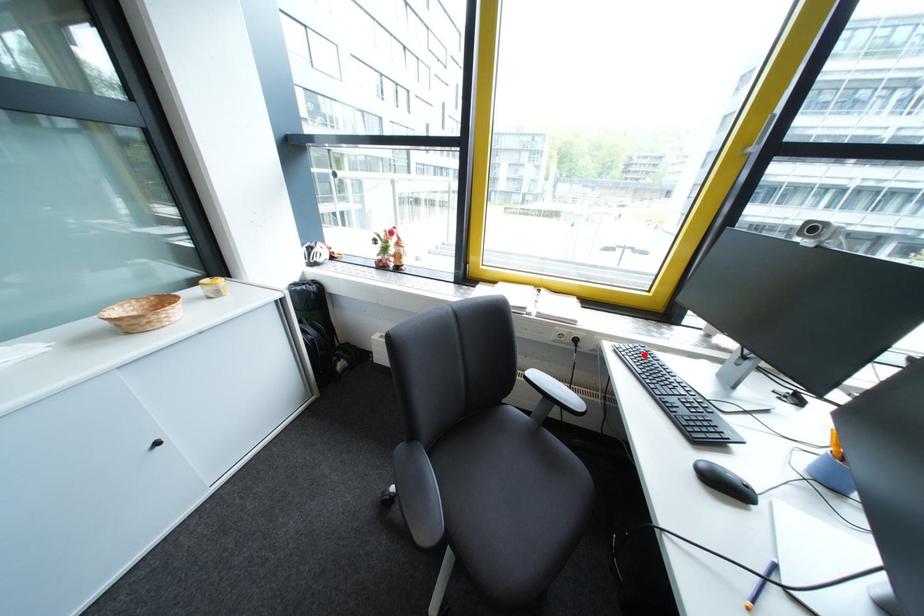
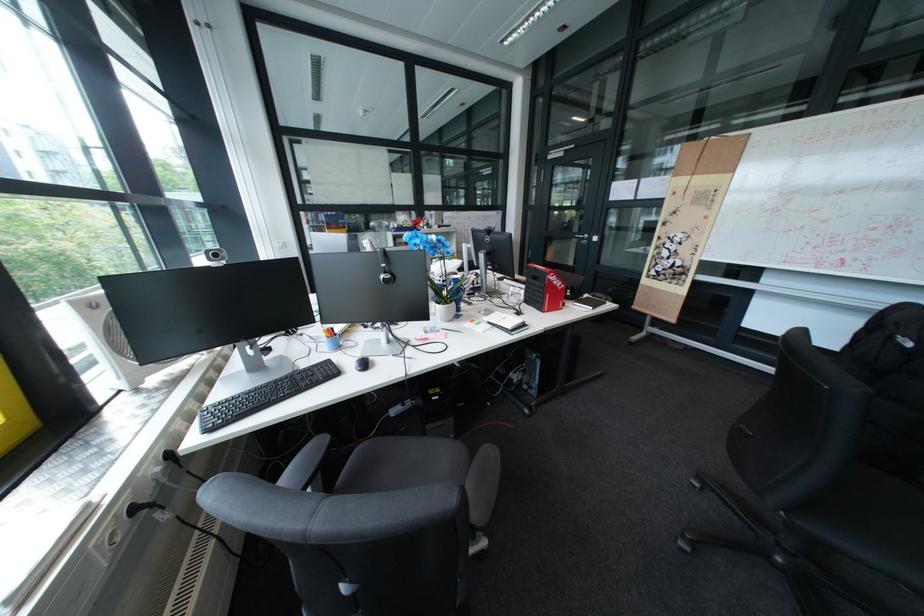
In the second image, find the point that corresponds to the highlighted location in the first image.

(245, 413)